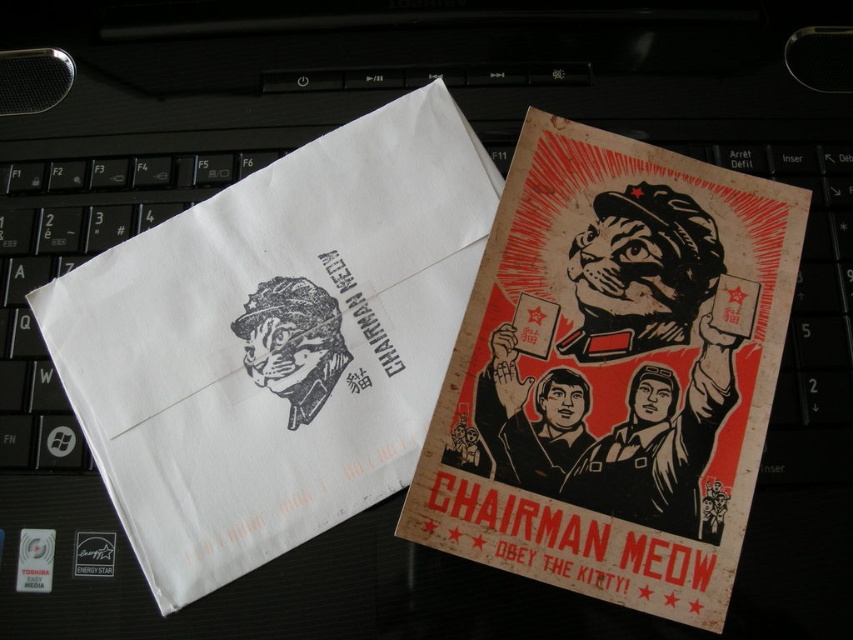
Which is below, white paper envelope at upper left or wooden poster at center?

wooden poster at center is lower down.

Does white paper envelope at upper left have a lesser height compared to wooden poster at center?

No.

Who is more distant from viewer, (403, 124) or (498, 492)?

Positioned behind is point (403, 124).

You are a GUI agent. You are given a task and a screenshot of the screen. Output one action in this format:
    pyautogui.click(x=<x>, y=<y>)
    Task: Click on the white paper envelope at upper left
    This screenshot has height=640, width=853.
    Given the screenshot: What is the action you would take?
    pyautogui.click(x=276, y=340)